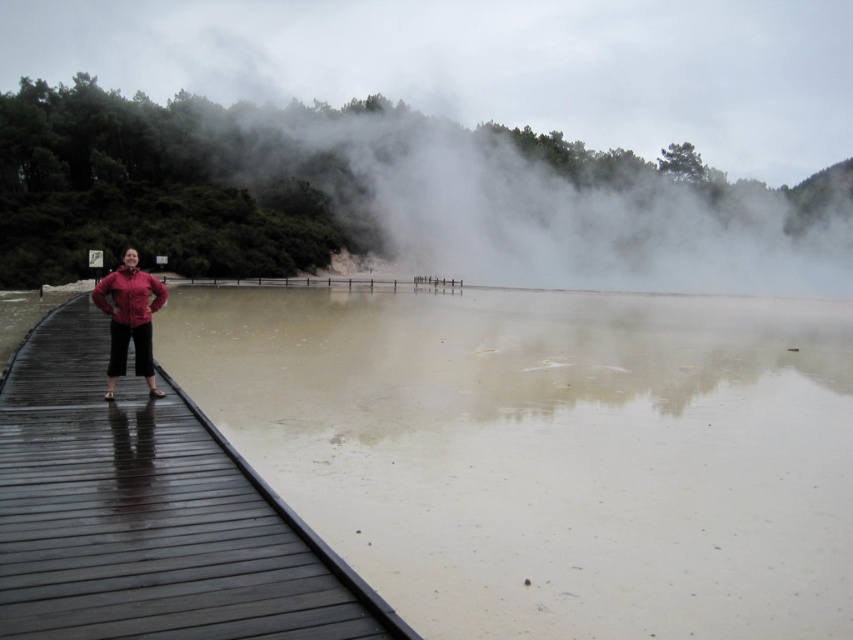
Is point (253, 305) positioned behind point (131, 285)?

Yes, it is behind point (131, 285).

Where is `muddy water at center`? The image size is (853, 640). muddy water at center is located at coordinates (548, 451).

Based on the photo, who is more distant from viewer, (532, 483) or (126, 321)?

Point (126, 321)

This screenshot has height=640, width=853. Identify the location of muddy water at center. (548, 451).

Is point (602, 209) closer to viewer compared to point (136, 285)?

No, it is not.

Is white fog at center thinner than matte red jacket at left?

No, white fog at center is not thinner than matte red jacket at left.

Is point (474, 193) positioned after point (137, 269)?

Yes, it is.

Image resolution: width=853 pixels, height=640 pixels. I want to click on white fog at center, so click(537, 204).

Which is in front, point (271, 634) or point (109, 289)?

Point (271, 634)

Does point (254, 636) come in front of point (148, 285)?

Yes, point (254, 636) is in front of point (148, 285).

Identify the location of dark wood dock at left. pos(148,515).

This screenshot has height=640, width=853. Identify the location of dark wood dock at left. (148, 515).